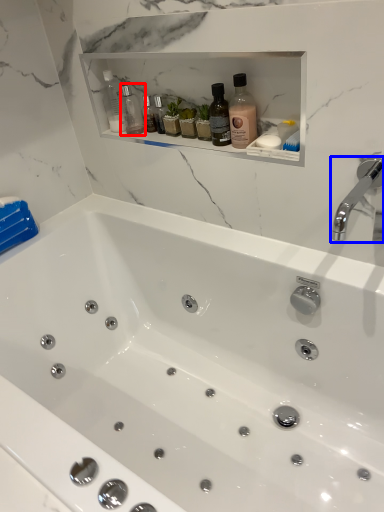
Question: Which of the following is the farthest to the observer, bottle (highlighted by a red box) or tap (highlighted by a blue box)?

Choices:
 (A) bottle
 (B) tap

Answer: (A)